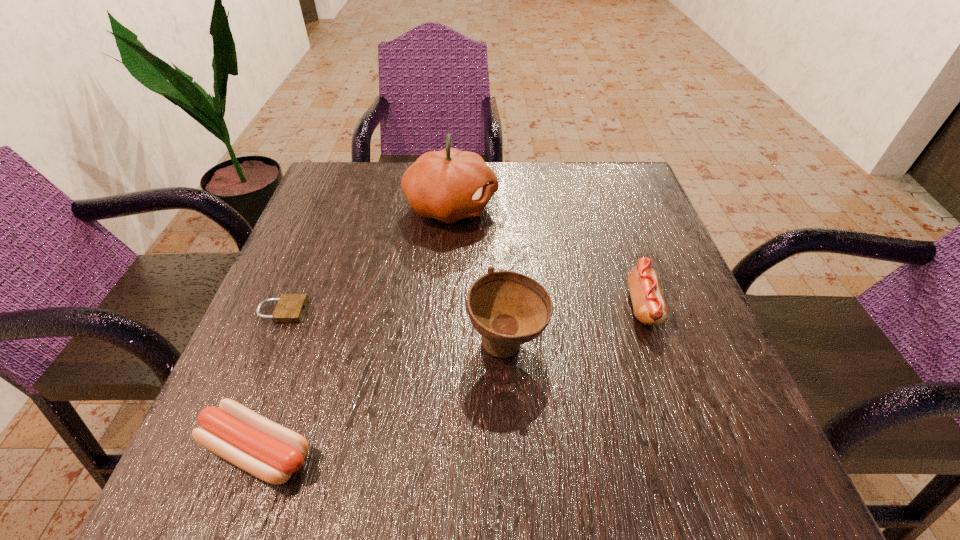
Where is `free space at the near edge`? free space at the near edge is located at coordinates (308, 487).

At what (x,y) coordinates should I click in order to perform the action: click on free space at the left edge. Please return your answer as a coordinate pair (x, y). Looking at the image, I should click on (287, 365).

In the image, there is a desktop. Identify the location of vacant space at the right edge. The width and height of the screenshot is (960, 540). tap(684, 282).

Locate an element on the screen. This screenshot has width=960, height=540. vacant space at the far left corner is located at coordinates (352, 214).

At what (x,y) coordinates should I click in order to perform the action: click on free space at the near left corner of the desktop. Please return your answer as a coordinate pair (x, y). This screenshot has height=540, width=960. Looking at the image, I should click on (222, 494).

This screenshot has width=960, height=540. I want to click on vacant space at the far right corner of the desktop, so click(x=589, y=190).

The height and width of the screenshot is (540, 960). In order to click on free spot at the near right corner of the desktop in this screenshot , I will do `click(673, 495)`.

I want to click on free space between the pumpkin and the soup bowl, so click(479, 275).

Where is `free space between the farther sausage and the tallest object`? free space between the farther sausage and the tallest object is located at coordinates (547, 256).

At what (x,y) coordinates should I click in order to perform the action: click on free point between the rightmost object and the padlock. Please return your answer as a coordinate pair (x, y). This screenshot has width=960, height=540. Looking at the image, I should click on (462, 308).